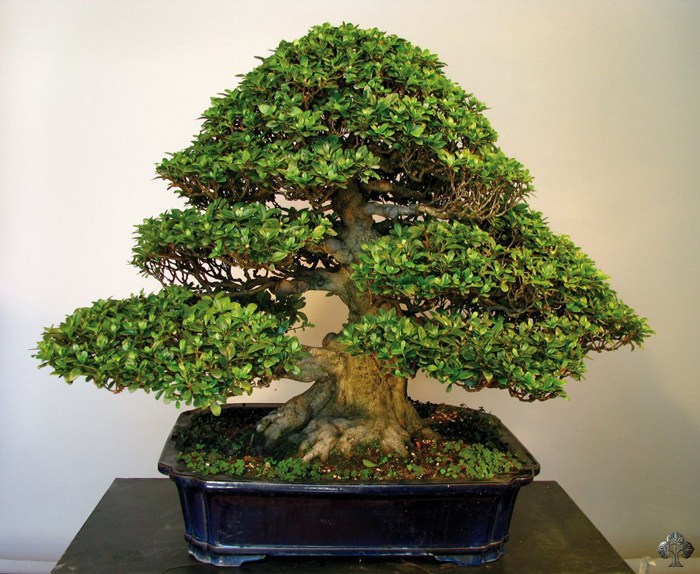
The height and width of the screenshot is (574, 700). Identify the location of blue ceramic pot. (448, 519), (253, 521).